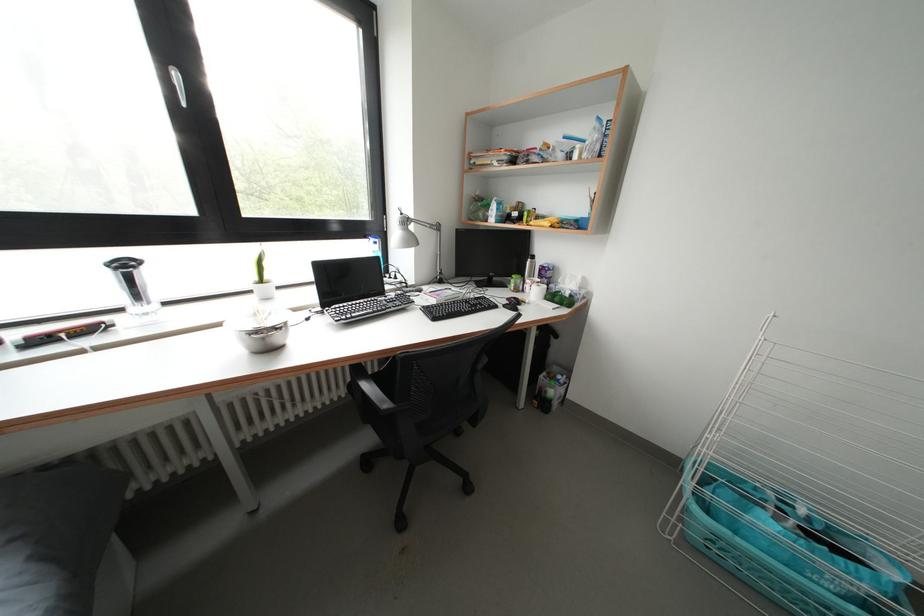
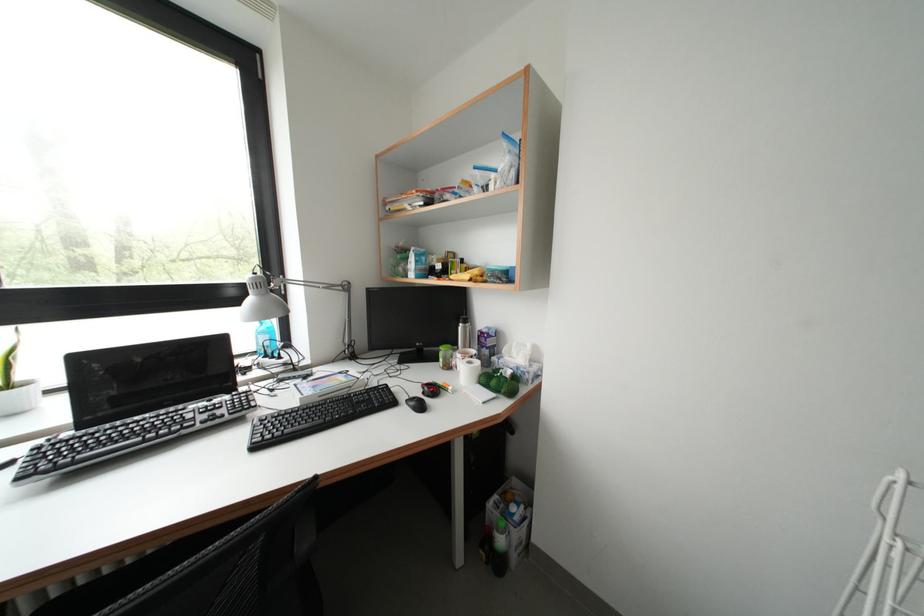
Where in the second image is the point corresponding to pixel 564 304 from the first image?

(500, 387)